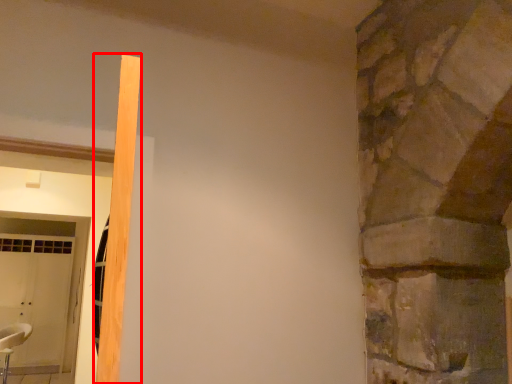
Question: In this image, where is beam (annotated by the red box) located relative to chair?

Choices:
 (A) right
 (B) left

Answer: (A)